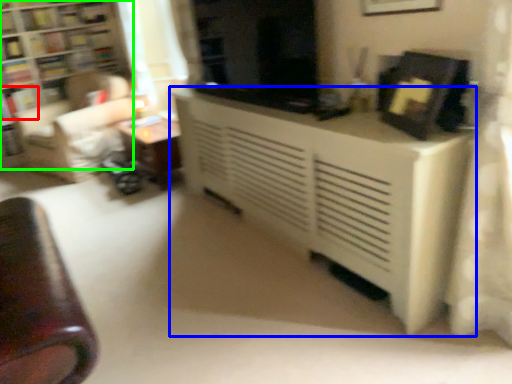
Question: Based on their relative distances, which object is farther from book (highlighted by a red box)? Choose from table (highlighted by a blue box) and bookcase (highlighted by a green box).

Choices:
 (A) table
 (B) bookcase

Answer: (A)